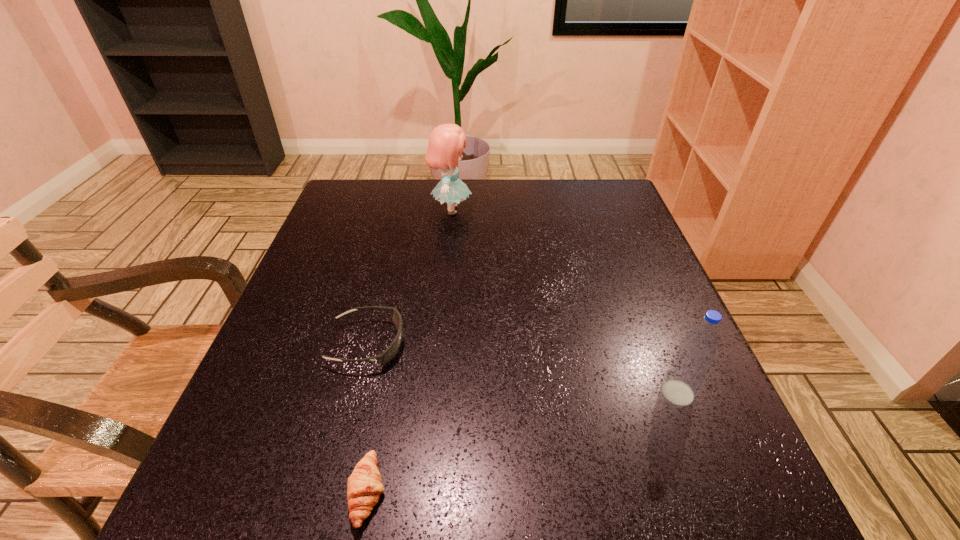
Image resolution: width=960 pixels, height=540 pixels. I want to click on vacant space located 0.060m on the front-facing side of the shortest object, so click(x=428, y=492).

The image size is (960, 540). I want to click on object that is at the far edge, so click(446, 143).

Find the location of a particular element. object present at the near edge is located at coordinates (364, 485).

Identify the location of object present at the left edge. This screenshot has width=960, height=540. (386, 356).

Find the location of a particular element. This screenshot has width=960, height=540. object located in the right edge section of the desktop is located at coordinates click(x=689, y=367).

At what (x,y) coordinates should I click in order to perform the action: click on vacant space at the far edge. Please return your answer as a coordinate pair (x, y). The width and height of the screenshot is (960, 540). Looking at the image, I should click on (397, 197).

Image resolution: width=960 pixels, height=540 pixels. Identify the location of vacant space at the near edge of the desktop. (343, 485).

Identify the location of free spot at the left edge of the desktop. The width and height of the screenshot is (960, 540). (315, 367).

In the image, there is a desktop. Where is `vacant region at the right edge`? vacant region at the right edge is located at coordinates (589, 276).

Where is `vacant space at the far left corner of the desktop`? The height and width of the screenshot is (540, 960). vacant space at the far left corner of the desktop is located at coordinates (348, 215).